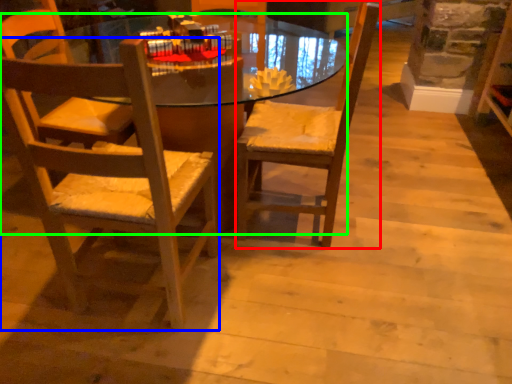
Question: Which object is the closest to the chair (highlighted by a red box)? Choose among these: chair (highlighted by a blue box) or desk (highlighted by a green box).

Choices:
 (A) chair
 (B) desk

Answer: (A)